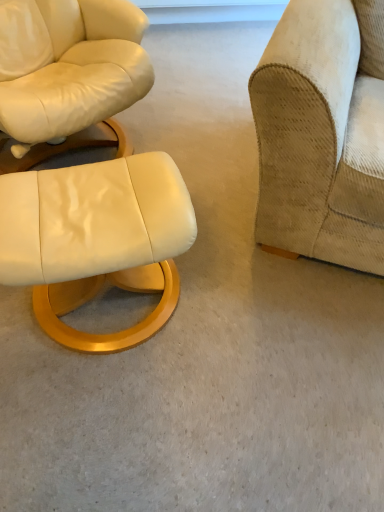
Question: Is beige corduroy couch at right positioned beyond the bounds of matte white leather ottoman at lower left?

Choices:
 (A) no
 (B) yes

Answer: (B)

Question: Considering the relative positions of beige corduroy couch at right and matte white leather ottoman at lower left in the image provided, is beige corduroy couch at right to the right of matte white leather ottoman at lower left from the viewer's perspective?

Choices:
 (A) yes
 (B) no

Answer: (A)

Question: From the image's perspective, is beige corduroy couch at right located beneath matte white leather ottoman at lower left?

Choices:
 (A) yes
 (B) no

Answer: (B)

Question: Can you confirm if beige corduroy couch at right is shorter than matte white leather ottoman at lower left?

Choices:
 (A) yes
 (B) no

Answer: (B)

Question: Is beige corduroy couch at right looking in the opposite direction of matte white leather ottoman at lower left?

Choices:
 (A) yes
 (B) no

Answer: (B)

Question: From the image's perspective, is beige corduroy couch at right over matte white leather ottoman at lower left?

Choices:
 (A) yes
 (B) no

Answer: (A)

Question: Is matte white leather ottoman at lower left taller than beige corduroy couch at right?

Choices:
 (A) no
 (B) yes

Answer: (A)

Question: Is matte white leather ottoman at lower left smaller than beige corduroy couch at right?

Choices:
 (A) no
 (B) yes

Answer: (B)

Question: From the image's perspective, does matte white leather ottoman at lower left appear lower than beige corduroy couch at right?

Choices:
 (A) yes
 (B) no

Answer: (A)

Question: Does matte white leather ottoman at lower left touch beige corduroy couch at right?

Choices:
 (A) yes
 (B) no

Answer: (B)

Question: Considering the relative positions of matte white leather ottoman at lower left and beige corduroy couch at right in the image provided, is matte white leather ottoman at lower left to the right of beige corduroy couch at right from the viewer's perspective?

Choices:
 (A) no
 (B) yes

Answer: (A)

Question: Is matte white leather ottoman at lower left closer to camera compared to beige corduroy couch at right?

Choices:
 (A) no
 (B) yes

Answer: (A)

Question: From their relative heights in the image, would you say beige corduroy couch at right is taller or shorter than matte white leather ottoman at lower left?

Choices:
 (A) tall
 (B) short

Answer: (A)